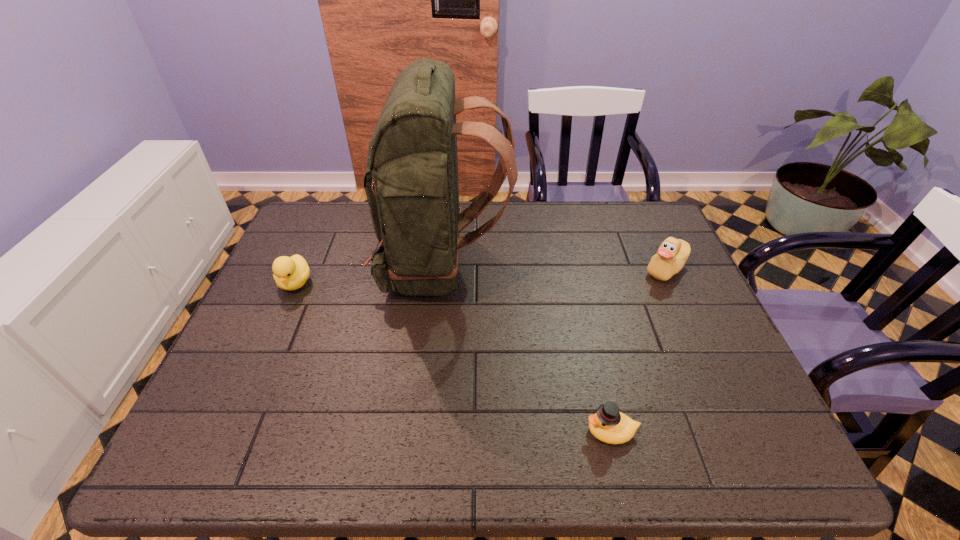
Where is `free space at the near edge of the desktop`? This screenshot has width=960, height=540. free space at the near edge of the desktop is located at coordinates (372, 439).

In the image, there is a desktop. At what (x,y) coordinates should I click in order to perform the action: click on vacant space at the left edge. Please return your answer as a coordinate pair (x, y). The height and width of the screenshot is (540, 960). Looking at the image, I should click on point(273,279).

The image size is (960, 540). Identify the location of blank space at the far left corner. (321, 240).

At what (x,y) coordinates should I click in order to perform the action: click on free space at the near left corner of the desktop. Please return your answer as a coordinate pair (x, y). The height and width of the screenshot is (540, 960). Looking at the image, I should click on tap(207, 438).

In the image, there is a desktop. Where is `free space at the far right corner`? The image size is (960, 540). free space at the far right corner is located at coordinates (662, 220).

Find the location of a particular element. Image resolution: width=960 pixels, height=540 pixels. unoccupied area between the shortest duck and the rightmost duck is located at coordinates (638, 350).

Locate an element on the screen. vacant region between the tallest object and the rightmost object is located at coordinates (554, 268).

You are a GUI agent. You are given a task and a screenshot of the screen. Output one action in this format:
    pyautogui.click(x=<x>, y=<y>)
    Task: Click on the unoccupied position between the nearest duck and the rightmost duck
    Image resolution: width=960 pixels, height=540 pixels.
    Given the screenshot: What is the action you would take?
    pyautogui.click(x=638, y=350)

Locate an element on the screen. The image size is (960, 540). vacant area that lies between the rightmost object and the tallest object is located at coordinates (554, 268).

At what (x,y) coordinates should I click in order to perform the action: click on vacant space that is in between the rightmost object and the third object from left to right. Please return your answer as a coordinate pair (x, y). The width and height of the screenshot is (960, 540). Looking at the image, I should click on (638, 350).